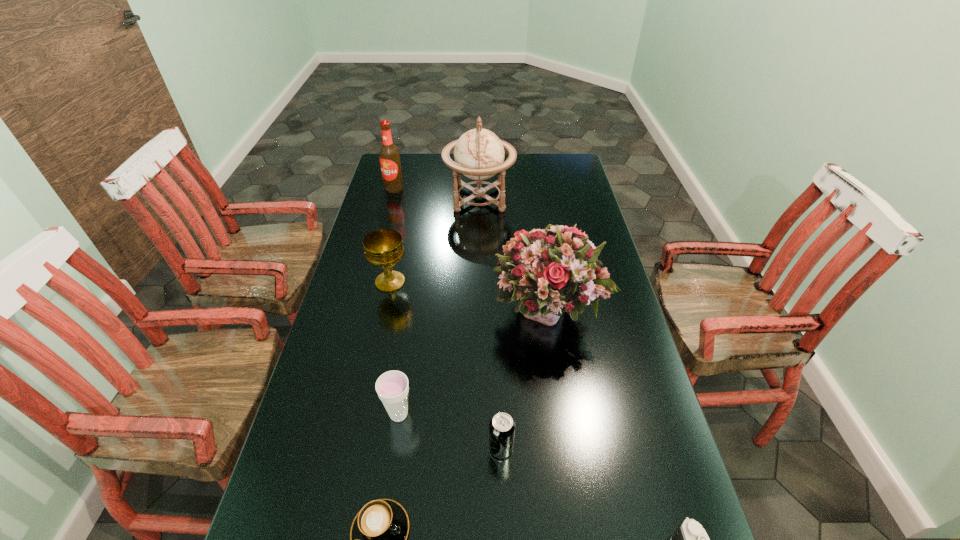
This screenshot has height=540, width=960. I want to click on vacant region located on the left of the fourth nearest object, so click(x=351, y=414).

The image size is (960, 540). Identify the location of vacant position located on the back of the soda can. (498, 389).

At what (x,y) coordinates should I click in order to perform the action: click on object that is at the far edge. Please return your answer as a coordinate pair (x, y). Looking at the image, I should click on (479, 154).

Where is `beer bottle located in the left edge section of the desktop`? beer bottle located in the left edge section of the desktop is located at coordinates (389, 155).

Identify the location of chalice positioned at the left edge. (383, 248).

You are a GUI agent. You are given a task and a screenshot of the screen. Output one action in this format:
    pyautogui.click(x=<x>, y=<y>)
    Task: Click on the object that is at the right edge
    The image size is (960, 540).
    Given the screenshot: What is the action you would take?
    pyautogui.click(x=548, y=271)

Locate an element on the screen. This screenshot has height=540, width=960. free space at the far edge of the desktop is located at coordinates (515, 180).

Where is `free spot at the left edge of the desktop`? This screenshot has height=540, width=960. free spot at the left edge of the desktop is located at coordinates (322, 369).

At what (x,y) coordinates should I click in order to perform the action: click on vacant space at the right edge of the desktop. Please return your answer as a coordinate pair (x, y). Looking at the image, I should click on (552, 203).

Image resolution: width=960 pixels, height=540 pixels. Identify the location of free spot at the far left corner of the desktop. (407, 180).